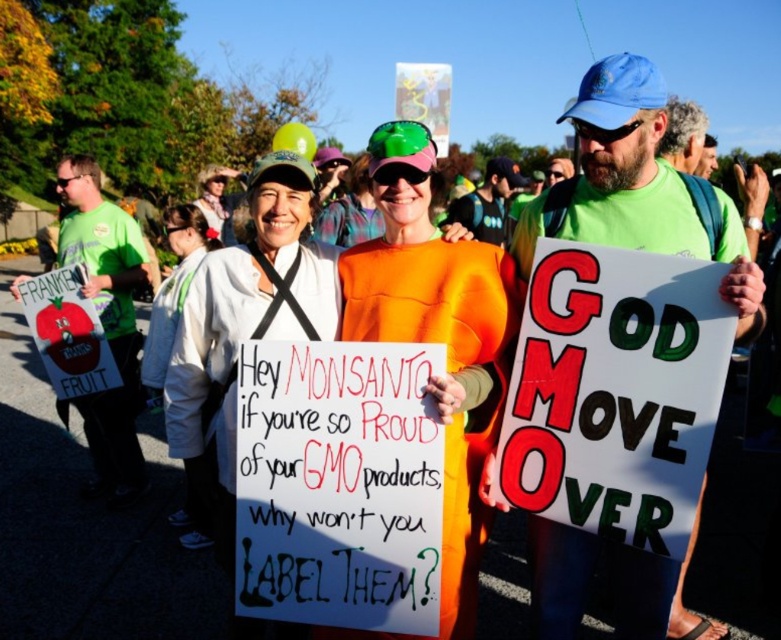
Question: Is orange fabric sign at center in front of orange fabric dress at center?

Choices:
 (A) no
 (B) yes

Answer: (A)

Question: Is white cardboard sign at center to the left of orange fabric dress at center from the viewer's perspective?

Choices:
 (A) yes
 (B) no

Answer: (B)

Question: Which point appears farthest from the camera in this image?

Choices:
 (A) (432, 561)
 (B) (503, 369)
 (C) (621, 384)
 (D) (209, 246)

Answer: (D)

Question: Can you confirm if white cardboard sign at center is bigger than orange fabric sign at center?

Choices:
 (A) no
 (B) yes

Answer: (B)

Question: Which point is closer to the camera?

Choices:
 (A) (308, 348)
 (B) (457, 301)
 (C) (512, 436)
 (D) (173, 220)

Answer: (A)

Question: Which point is closer to the camera taking this photo?

Choices:
 (A) (458, 368)
 (B) (672, 406)
 (C) (250, 426)

Answer: (B)